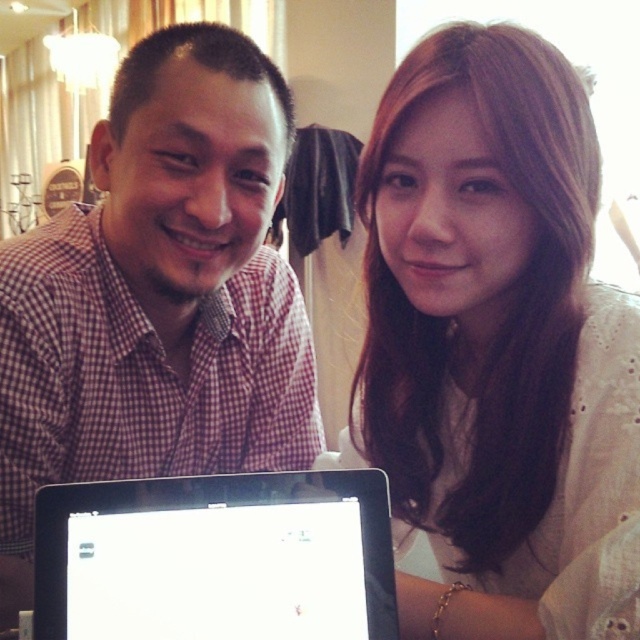
Question: Which is nearer to the checkered fabric shirt at center?

Choices:
 (A) white lace shirt at upper right
 (B) black glossy laptop at center

Answer: (A)

Question: Can you confirm if white lace shirt at upper right is bigger than black glossy laptop at center?

Choices:
 (A) yes
 (B) no

Answer: (A)

Question: Does checkered fabric shirt at center have a lesser width compared to black glossy laptop at center?

Choices:
 (A) no
 (B) yes

Answer: (A)

Question: Which is farther from the white lace shirt at upper right?

Choices:
 (A) black glossy laptop at center
 (B) checkered fabric shirt at center

Answer: (B)

Question: Which point is closer to the camera?

Choices:
 (A) white lace shirt at upper right
 (B) black glossy laptop at center
 (C) checkered fabric shirt at center

Answer: (A)

Question: Can you confirm if white lace shirt at upper right is positioned above black glossy laptop at center?

Choices:
 (A) no
 (B) yes

Answer: (B)